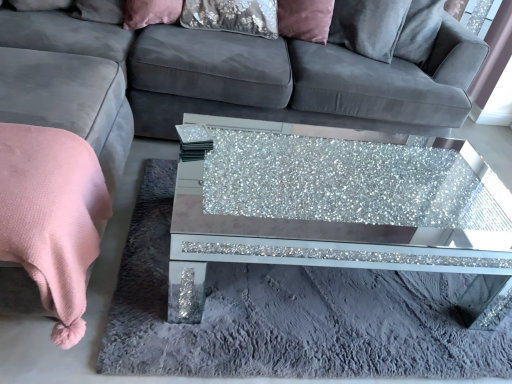
Question: Is velvet pink pillow at upper center facing away from pink soft blanket at lower left?

Choices:
 (A) no
 (B) yes

Answer: (A)

Question: Can you confirm if velvet pink pillow at upper center is wider than pink soft blanket at lower left?

Choices:
 (A) yes
 (B) no

Answer: (B)

Question: Considering the relative positions of velvet pink pillow at upper center and pink soft blanket at lower left in the image provided, is velvet pink pillow at upper center behind pink soft blanket at lower left?

Choices:
 (A) no
 (B) yes

Answer: (B)

Question: Can you confirm if velvet pink pillow at upper center is thinner than pink soft blanket at lower left?

Choices:
 (A) yes
 (B) no

Answer: (A)

Question: From a real-world perspective, is velvet pink pillow at upper center over pink soft blanket at lower left?

Choices:
 (A) no
 (B) yes

Answer: (B)

Question: From a real-world perspective, is velvet fabric couch at center positioned above or below velvet pink pillow at upper center?

Choices:
 (A) above
 (B) below

Answer: (B)

Question: Considering the positions of velvet fabric couch at center and velvet pink pillow at upper center in the image, is velvet fabric couch at center bigger or smaller than velvet pink pillow at upper center?

Choices:
 (A) small
 (B) big

Answer: (B)

Question: Considering their positions, is velvet fabric couch at center located in front of or behind velvet pink pillow at upper center?

Choices:
 (A) behind
 (B) front

Answer: (B)

Question: Is point (226, 92) positioned closer to the camera than point (166, 23)?

Choices:
 (A) closer
 (B) farther

Answer: (A)

Question: From a real-world perspective, is velvet fabric couch at center physically located above or below pink soft blanket at lower left?

Choices:
 (A) above
 (B) below

Answer: (A)

Question: Which is correct: velvet fabric couch at center is inside pink soft blanket at lower left, or outside of it?

Choices:
 (A) inside
 (B) outside

Answer: (B)

Question: Is point (89, 38) positioned closer to the camera than point (39, 127)?

Choices:
 (A) closer
 (B) farther

Answer: (B)

Question: Is velvet fabric couch at center wider or thinner than pink soft blanket at lower left?

Choices:
 (A) wide
 (B) thin

Answer: (A)

Question: From a real-world perspective, is pink soft blanket at lower left positioned above or below velvet pink pillow at upper center?

Choices:
 (A) below
 (B) above

Answer: (A)

Question: From the image's perspective, relative to velvet pink pillow at upper center, is pink soft blanket at lower left above or below?

Choices:
 (A) below
 (B) above

Answer: (A)